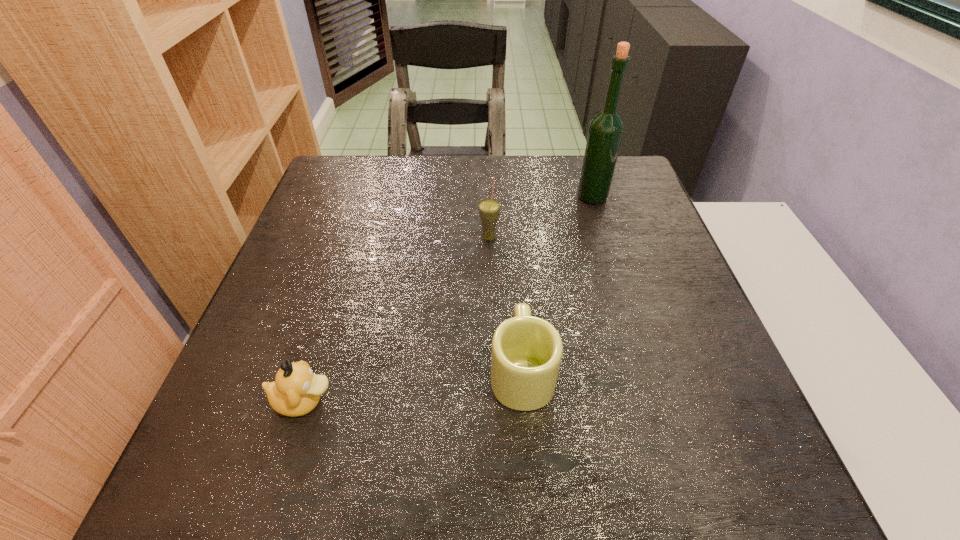
At what (x,y) coordinates should I click in order to perform the action: click on liquor. Please return your answer as a coordinate pair (x, y). The height and width of the screenshot is (540, 960). Looking at the image, I should click on (606, 129).

This screenshot has width=960, height=540. I want to click on the tallest object, so click(606, 129).

Identify the location of the second farthest object. Image resolution: width=960 pixels, height=540 pixels. pyautogui.click(x=489, y=209).

In order to click on straw for drinking in this screenshot , I will do `click(489, 209)`.

At what (x,y) coordinates should I click in order to perform the action: click on mug. Please return your answer as a coordinate pair (x, y). The image size is (960, 540). Looking at the image, I should click on (526, 354).

You are a GUI agent. You are given a task and a screenshot of the screen. Output one action in this format:
    pyautogui.click(x=<x>, y=<y>)
    Task: Click on the leftmost object
    This screenshot has height=540, width=960.
    Given the screenshot: What is the action you would take?
    pyautogui.click(x=296, y=391)

Locate an element on the screen. Image resolution: width=960 pixels, height=540 pixels. vacant area located on the front of the farthest object is located at coordinates (615, 272).

Where is `free space located 0.320m on the right of the second farthest object`? This screenshot has height=540, width=960. free space located 0.320m on the right of the second farthest object is located at coordinates (632, 238).

Where is `vacant space located 0.210m with the handle on the side of the mug`? This screenshot has height=540, width=960. vacant space located 0.210m with the handle on the side of the mug is located at coordinates (514, 261).

Image resolution: width=960 pixels, height=540 pixels. What are the coordinates of `free location located with the handle on the side of the mug` in the screenshot? It's located at (516, 296).